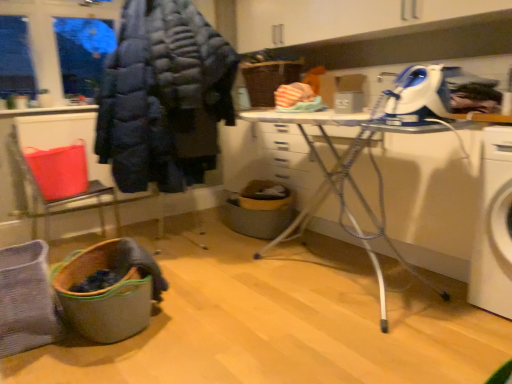
Locate an element on the screen. The width and height of the screenshot is (512, 384). free space on the front side of wooden laundry basket at lower left is located at coordinates (108, 361).